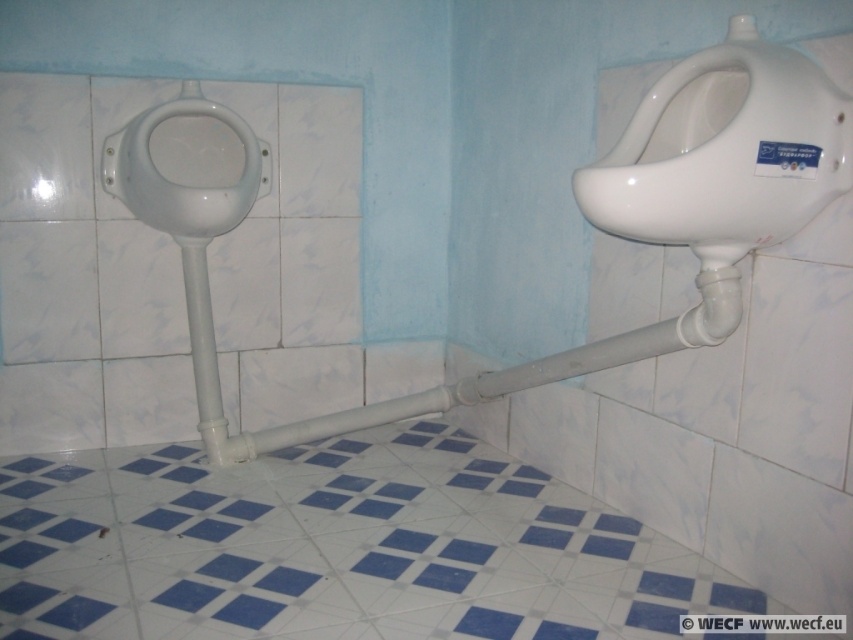
You are a maintenance worker inspecting the restroom plumbing. You notice the white glossy bidet at left and the white glossy pipe at center. Which object is located below the other?

The white glossy pipe at center is positioned under the white glossy bidet at left, so the pipe is below the bidet.

You are a maintenance worker who needs to reach the white glossy pipe at center and the white glossy bidet at left for inspection. Considering their heights, which one will require you to use a ladder?

The white glossy pipe at center is much taller than the white glossy bidet at left, so you will need to use a ladder to reach the white glossy pipe at center.